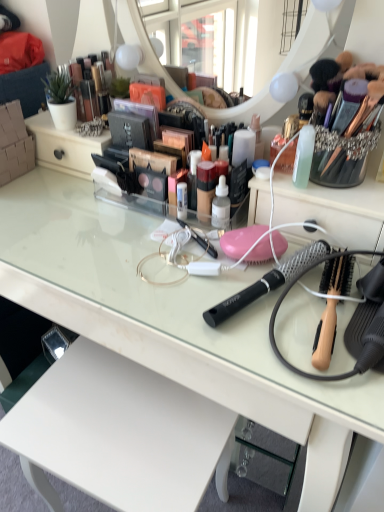
Identify the location of free space in front of wooden-handled hairbrush at right, the 2th brush in the left-to-right sequence. This screenshot has height=512, width=384. (340, 372).